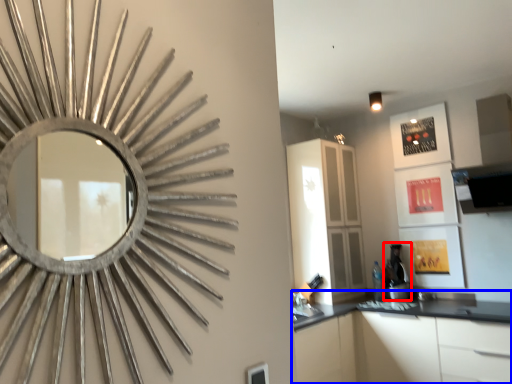
Question: Which object is closer to the camera taking this photo, coffee machine (highlighted by a red box) or cabinetry (highlighted by a blue box)?

Choices:
 (A) coffee machine
 (B) cabinetry

Answer: (B)